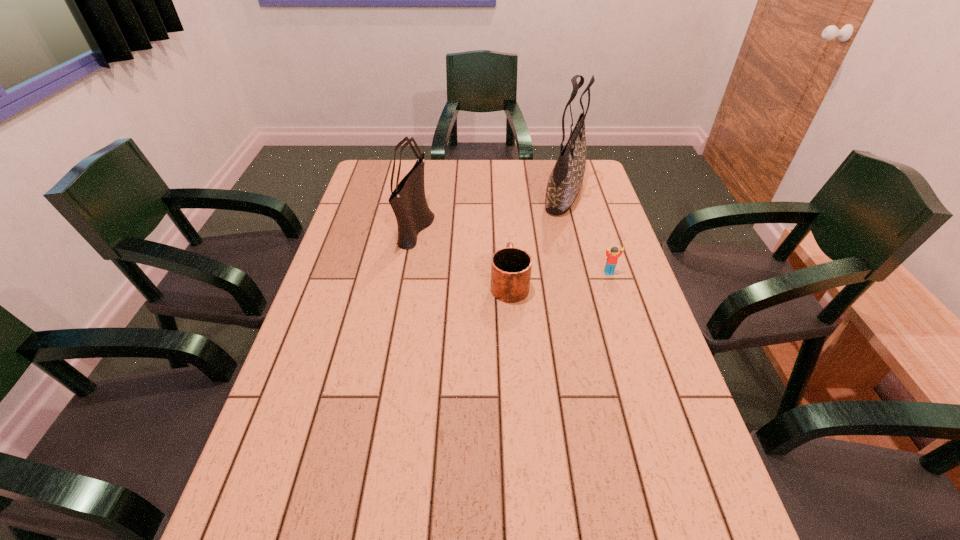
At what (x,y) coordinates should I click in order to perform the action: click on vacant area that lies between the tallest object and the second tallest object. Please return your answer as a coordinate pair (x, y). Looking at the image, I should click on (491, 210).

In order to click on vacant space that's between the tote bag and the shortest object in this screenshot , I will do click(x=587, y=232).

Identify the location of empty space that is in between the Lego and the third object from right to left. The image size is (960, 540). (559, 278).

Choose which object is the second nearest neighbor to the shoulder bag. Please provide its 2D coordinates. Your answer should be formatted as a tuple, i.e. [(x, y)], where the tuple contains the x and y coordinates of a point satisfying the conditions above.

[(564, 184)]

Locate which object ranks second in proximity to the second object from left to right. Please provide its 2D coordinates. Your answer should be formatted as a tuple, i.e. [(x, y)], where the tuple contains the x and y coordinates of a point satisfying the conditions above.

[(612, 257)]

Where is `free space in the image that satisfies the following two spatial constraints: 1. on the side of the tote bag with the handle; 2. on the right side of the third object from right to left`? Image resolution: width=960 pixels, height=540 pixels. free space in the image that satisfies the following two spatial constraints: 1. on the side of the tote bag with the handle; 2. on the right side of the third object from right to left is located at coordinates (503, 192).

In order to click on vacant space that satisfies the following two spatial constraints: 1. on the side of the second object from left to right with the handle; 2. on the left side of the tallest object in this screenshot , I will do `click(503, 192)`.

Where is `free space in the image that satisfies the following two spatial constraints: 1. on the side of the tote bag with the handle; 2. on the left side of the mug`? free space in the image that satisfies the following two spatial constraints: 1. on the side of the tote bag with the handle; 2. on the left side of the mug is located at coordinates (503, 192).